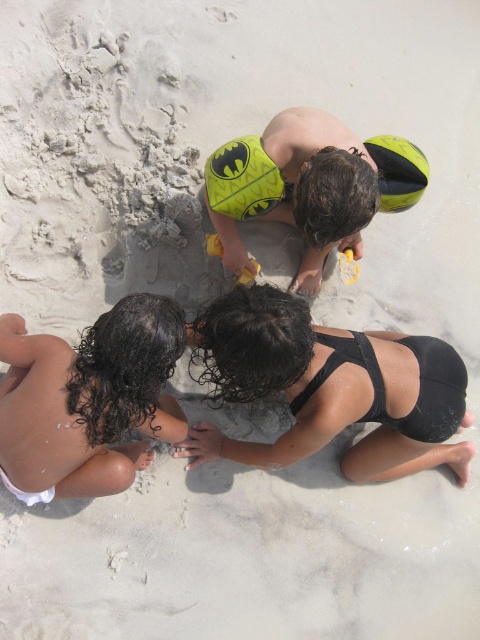
You are a child at the beach and want to place your yellow plastic shovel at center next to the yellow rubber ball at upper center. Which object is taller and would require more space vertically?

The yellow rubber ball at upper center is taller than the yellow plastic shovel at center, so it would require more vertical space.

You are a child at the beach holding a yellow plastic shovel at center. You want to pick up the yellow rubber ball at upper center. Can you reach it without moving your feet?

The yellow rubber ball at upper center is 63.11 centimeters away from the yellow plastic shovel at center. Since the average reach for a child is about 50 centimeters, you would need to move your feet to reach it.

You are a photographer positioned at the beach scene. You want to capture a photo focusing on the black matte swimsuit at center and the yellow matte swimsuit at center. Which swimmer is closer to your camera lens?

The black matte swimsuit at center is closer to the viewer than the yellow matte swimsuit at center, so the black matte swimsuit at center will appear closer to the camera lens in the photo.